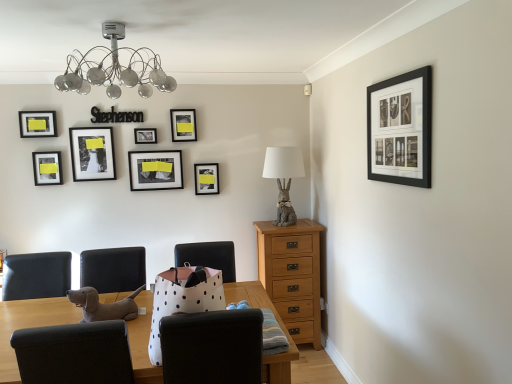
This screenshot has width=512, height=384. Find the location of `matte black photo frame at upper left, which is the 4th picture frame in front-to-back order`. matte black photo frame at upper left, which is the 4th picture frame in front-to-back order is located at coordinates (92, 153).

The image size is (512, 384). What do you see at coordinates (92, 153) in the screenshot?
I see `matte black photo frame at upper left, which appears as the 3th picture frame when viewed from the left` at bounding box center [92, 153].

The image size is (512, 384). What do you see at coordinates (37, 124) in the screenshot?
I see `matte black picture frame at upper left, the 8th picture frame when ordered from right to left` at bounding box center [37, 124].

How much space does matte black picture frame at left, marked as the second picture frame in a left-to-right arrangement, occupy vertically?

The height of matte black picture frame at left, marked as the second picture frame in a left-to-right arrangement, is 10.35 inches.

Measure the distance between point (148, 143) and camera.

The depth of point (148, 143) is 3.46 meters.

You are a GUI agent. You are given a task and a screenshot of the screen. Output one action in this format:
    pyautogui.click(x=<x>, y=<y>)
    Task: Click on the brown fabric chair at lower left, which ranks as the second chair in right-to-left order
    
    Given the screenshot: What is the action you would take?
    pyautogui.click(x=74, y=354)

How much space does brown fabric chair at lower left, which is the first chair in left-to-right order, occupy horizontally?

It is 23.85 inches.

Locate an element on the screen. light brown wooden chest of drawers at center-right is located at coordinates (292, 275).

Consider the image. Is matte black picture frame at left, the seventh picture frame when ordered from right to left, facing away from light brown wooden chest of drawers at center-right?

No, matte black picture frame at left, the seventh picture frame when ordered from right to left, is not facing the opposite direction of light brown wooden chest of drawers at center-right.

Is the depth of matte black picture frame at left, the seventh picture frame when ordered from right to left, less than that of light brown wooden chest of drawers at center-right?

No, the depth of matte black picture frame at left, the seventh picture frame when ordered from right to left, is greater than that of light brown wooden chest of drawers at center-right.

Is matte black picture frame at left, marked as the 3th picture frame in a front-to-back arrangement, next to light brown wooden chest of drawers at center-right and touching it?

They are not placed beside each other.

Considering the relative sizes of matte black picture frame at left, the 6th picture frame when ordered from back to front, and light brown wooden chest of drawers at center-right in the image provided, is matte black picture frame at left, the 6th picture frame when ordered from back to front, smaller than light brown wooden chest of drawers at center-right?

Correct, matte black picture frame at left, the 6th picture frame when ordered from back to front, occupies less space than light brown wooden chest of drawers at center-right.

Between point (133, 159) and point (164, 362), which one is positioned behind?

The point (133, 159) is behind.

In terms of height, does matte black picture frame at upper center, arranged as the sixth picture frame when viewed from the front, look taller or shorter compared to white polka dot paper bag at center, positioned as the 2th chair in left-to-right order?

Considering their sizes, matte black picture frame at upper center, arranged as the sixth picture frame when viewed from the front, has less height than white polka dot paper bag at center, positioned as the 2th chair in left-to-right order.

Starting from the matte black picture frame at upper center, the fifth picture frame from the left, which chair is the 2nd one to the right? Please provide its 2D coordinates.

[(212, 347)]

Is matte black picture frame at upper center, which appears as the 4th picture frame when viewed from the right, facing away from white polka dot paper bag at center, positioned as the 2th chair in left-to-right order?

matte black picture frame at upper center, which appears as the 4th picture frame when viewed from the right, does not have its back to white polka dot paper bag at center, positioned as the 2th chair in left-to-right order.

Looking at their sizes, would you say matte black picture frame at upper center, which appears as the 4th picture frame when viewed from the right, is wider or thinner than metallic glass chandelier at upper center?

matte black picture frame at upper center, which appears as the 4th picture frame when viewed from the right, is thinner than metallic glass chandelier at upper center.

Considering the positions of objects matte black picture frame at upper center, which is the third picture frame in back-to-front order, and metallic glass chandelier at upper center in the image provided, who is behind, matte black picture frame at upper center, which is the third picture frame in back-to-front order, or metallic glass chandelier at upper center?

matte black picture frame at upper center, which is the third picture frame in back-to-front order.

Is matte black picture frame at upper center, which is the third picture frame in back-to-front order, inside the boundaries of metallic glass chandelier at upper center, or outside?

The correct answer is: outside.

Considering the positions of point (143, 177) and point (143, 87), is point (143, 177) closer or farther from the camera than point (143, 87)?

Clearly, point (143, 177) is more distant from the camera than point (143, 87).

How far apart are white polka dot paper bag at center, placed as the 1th chair when sorted from right to left, and light brown wooden chest of drawers at center-right?

white polka dot paper bag at center, placed as the 1th chair when sorted from right to left, and light brown wooden chest of drawers at center-right are 1.67 meters apart.

Does white polka dot paper bag at center, placed as the 1th chair when sorted from right to left, have a lesser width compared to light brown wooden chest of drawers at center-right?

No, white polka dot paper bag at center, placed as the 1th chair when sorted from right to left, is not thinner than light brown wooden chest of drawers at center-right.

Which object is closer to the camera, white polka dot paper bag at center, positioned as the 2th chair in left-to-right order, or light brown wooden chest of drawers at center-right?

white polka dot paper bag at center, positioned as the 2th chair in left-to-right order, is closer to the camera.

How many degrees apart are the facing directions of white polka dot paper bag at center, placed as the 1th chair when sorted from right to left, and light brown wooden chest of drawers at center-right?

They differ by 179 degrees in their facing directions.

Does black matte picture frame at upper center, marked as the 4th picture frame in a left-to-right arrangement, lie behind matte black photo frame at upper left, which appears as the 3th picture frame when viewed from the left?

That is True.

What's the angular difference between black matte picture frame at upper center, marked as the 4th picture frame in a left-to-right arrangement, and matte black photo frame at upper left, which is the 4th picture frame in front-to-back order,'s facing directions?

There is a 0.000381-degree angle between the facing directions of black matte picture frame at upper center, marked as the 4th picture frame in a left-to-right arrangement, and matte black photo frame at upper left, which is the 4th picture frame in front-to-back order.

How distant is black matte picture frame at upper center, acting as the fifth picture frame starting from the right, from matte black photo frame at upper left, which is the 4th picture frame in front-to-back order?

black matte picture frame at upper center, acting as the fifth picture frame starting from the right, and matte black photo frame at upper left, which is the 4th picture frame in front-to-back order, are 14.03 inches apart from each other.

Between black matte picture frame at upper center, marked as the 4th picture frame in a left-to-right arrangement, and matte black photo frame at upper left, which is the 4th picture frame in front-to-back order, which one has more height?

matte black photo frame at upper left, which is the 4th picture frame in front-to-back order, is taller.

Is matte gray rabbit at center right located within matte black picture frame at upper center, acting as the 3th picture frame starting from the right?

No, matte gray rabbit at center right is not inside matte black picture frame at upper center, acting as the 3th picture frame starting from the right.

Does matte black picture frame at upper center, which is counted as the 7th picture frame, starting from the front, have a greater height compared to matte gray rabbit at center right?

In fact, matte black picture frame at upper center, which is counted as the 7th picture frame, starting from the front, may be shorter than matte gray rabbit at center right.

Based on the photo, from a real-world perspective, does matte black picture frame at upper center, which is counted as the 7th picture frame, starting from the front, sit lower than matte gray rabbit at center right?

No, from a real-world perspective, matte black picture frame at upper center, which is counted as the 7th picture frame, starting from the front, is not below matte gray rabbit at center right.

Can you confirm if matte black picture frame at upper center, acting as the 3th picture frame starting from the right, is smaller than matte gray rabbit at center right?

Correct, matte black picture frame at upper center, acting as the 3th picture frame starting from the right, occupies less space than matte gray rabbit at center right.

You are a GUI agent. You are given a task and a screenshot of the screen. Output one action in this format:
    pyautogui.click(x=<x>, y=<y>)
    Task: Click on the animal that is on the left side of white polka dot paper bag at center, positioned as the 2th chair in left-to-right order
    
    Given the screenshot: What is the action you would take?
    pyautogui.click(x=104, y=305)

Based on the photo, is white polka dot paper bag at center, placed as the 1th chair when sorted from right to left, surrounded by fuzzy fabric dog at lower left?

Actually, white polka dot paper bag at center, placed as the 1th chair when sorted from right to left, is outside fuzzy fabric dog at lower left.

Is fuzzy fabric dog at lower left in contact with white polka dot paper bag at center, placed as the 1th chair when sorted from right to left?

No, fuzzy fabric dog at lower left is not touching white polka dot paper bag at center, placed as the 1th chair when sorted from right to left.

Considering the sizes of objects fuzzy fabric dog at lower left and white polka dot paper bag at center, positioned as the 2th chair in left-to-right order, in the image provided, who is smaller, fuzzy fabric dog at lower left or white polka dot paper bag at center, positioned as the 2th chair in left-to-right order,?

fuzzy fabric dog at lower left.

Which picture frame is the 2nd one when counting from the back of the light brown wooden chest of drawers at center-right? Please provide its 2D coordinates.

[(47, 168)]

There is a matte black picture frame at upper center, arranged as the sixth picture frame when viewed from the front. Identify the location of the 2nd chair below it (from a real-world perspective). This screenshot has height=384, width=512. click(x=212, y=347).

Looking at the image, which one is located closer to white polka dot paper bag at center, positioned as the 2th chair in left-to-right order, matte black picture frame at upper left, the 2th picture frame when ordered from front to back, or black matte picture frame at upper center, marked as the 4th picture frame in a left-to-right arrangement?

black matte picture frame at upper center, marked as the 4th picture frame in a left-to-right arrangement, is positioned closer to the anchor white polka dot paper bag at center, positioned as the 2th chair in left-to-right order.

From the picture: Considering their positions, is black matte picture frame at upper right, which is counted as the 8th picture frame, starting from the left, positioned closer to black matte picture frame at upper center, which ranks as the fourth picture frame in back-to-front order, than matte gray rabbit at center right?

Based on the image, matte gray rabbit at center right appears to be nearer to black matte picture frame at upper center, which ranks as the fourth picture frame in back-to-front order.

Based on their spatial positions, is matte gray rabbit at center right or matte black picture frame at center, the 7th picture frame when ordered from left to right, further from black matte picture frame at upper right, acting as the 1th picture frame starting from the front?

Among the two, matte black picture frame at center, the 7th picture frame when ordered from left to right, is located further to black matte picture frame at upper right, acting as the 1th picture frame starting from the front.

Which object lies further to the anchor point fuzzy fabric dog at lower left, white polka dot paper bag at center, placed as the 1th chair when sorted from right to left, or matte black picture frame at upper center, which is counted as the 7th picture frame, starting from the front?

matte black picture frame at upper center, which is counted as the 7th picture frame, starting from the front, is positioned further to the anchor fuzzy fabric dog at lower left.

Based on their spatial positions, is white polka dot paper bag at center, positioned as the 2th chair in left-to-right order, or matte black picture frame at upper left, acting as the first picture frame starting from the left, further from matte black picture frame at left, marked as the 3th picture frame in a front-to-back arrangement?

white polka dot paper bag at center, positioned as the 2th chair in left-to-right order, is positioned further to the anchor matte black picture frame at left, marked as the 3th picture frame in a front-to-back arrangement.

Considering their positions, is matte gray rabbit at center right positioned further to matte black picture frame at upper center, acting as the second picture frame starting from the back, than black matte picture frame at upper center, which ranks as the fourth picture frame in back-to-front order?

Among the two, matte gray rabbit at center right is located further to matte black picture frame at upper center, acting as the second picture frame starting from the back.

Estimate the real-world distances between objects in this image. Which object is further from matte black picture frame at upper center, acting as the 3th picture frame starting from the right, metallic glass chandelier at upper center or light brown wooden chest of drawers at center-right?

Among the two, light brown wooden chest of drawers at center-right is located further to matte black picture frame at upper center, acting as the 3th picture frame starting from the right.

Looking at the image, which one is located closer to white polka dot paper bag at center, positioned as the 2th chair in left-to-right order, matte black picture frame at upper center, which is counted as the 7th picture frame, starting from the front, or matte black photo frame at upper left, which appears as the 3th picture frame when viewed from the left?

matte black photo frame at upper left, which appears as the 3th picture frame when viewed from the left, lies closer to white polka dot paper bag at center, positioned as the 2th chair in left-to-right order, than the other object.

Identify the location of animal between white polka dot paper bag at center, positioned as the 2th chair in left-to-right order, and matte gray rabbit at center right, along the z-axis. The image size is (512, 384). (104, 305).

Identify the location of table lamp positioned between white polka dot paper bag at center, positioned as the 2th chair in left-to-right order, and light brown wooden chest of drawers at center-right from near to far. The image size is (512, 384). pyautogui.click(x=284, y=179).

The image size is (512, 384). I want to click on lamp between white polka dot paper bag at center, positioned as the 2th chair in left-to-right order, and light brown wooden chest of drawers at center-right from front to back, so click(x=114, y=69).

Locate an element on the screen. This screenshot has height=384, width=512. chest of drawers between metallic glass chandelier at upper center and matte black picture frame at upper center, which appears as the 4th picture frame when viewed from the right, in the front-back direction is located at coordinates (292, 275).